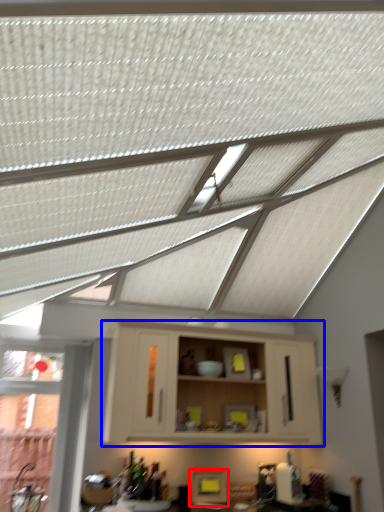
Question: Among these objects, which one is farthest to the camera, appliance (highlighted by a red box) or cabinetry (highlighted by a blue box)?

Choices:
 (A) appliance
 (B) cabinetry

Answer: (A)